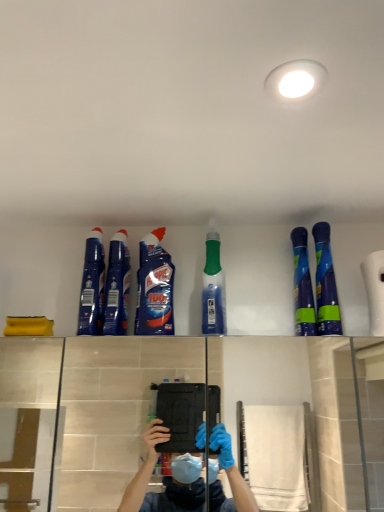
Question: Does blue glossy cleaner at upper left, the 6th cleaning product when ordered from right to left, come behind green translucent bottle at center, which is counted as the third cleaning product, starting from the right?

Choices:
 (A) no
 (B) yes

Answer: (B)

Question: From the image's perspective, is blue glossy cleaner at upper left, placed as the 1th cleaning product when sorted from left to right, under green translucent bottle at center, marked as the fourth cleaning product in a left-to-right arrangement?

Choices:
 (A) no
 (B) yes

Answer: (B)

Question: Is blue glossy cleaner at upper left, the 6th cleaning product when ordered from right to left, taller than green translucent bottle at center, marked as the fourth cleaning product in a left-to-right arrangement?

Choices:
 (A) yes
 (B) no

Answer: (B)

Question: Does blue glossy cleaner at upper left, the 6th cleaning product when ordered from right to left, lie in front of green translucent bottle at center, marked as the fourth cleaning product in a left-to-right arrangement?

Choices:
 (A) no
 (B) yes

Answer: (A)

Question: Considering the relative sizes of blue glossy cleaner at upper left, placed as the 1th cleaning product when sorted from left to right, and green translucent bottle at center, marked as the fourth cleaning product in a left-to-right arrangement, in the image provided, is blue glossy cleaner at upper left, placed as the 1th cleaning product when sorted from left to right, thinner than green translucent bottle at center, marked as the fourth cleaning product in a left-to-right arrangement,?

Choices:
 (A) no
 (B) yes

Answer: (A)

Question: In terms of height, does blue glossy spray bottles at upper right, the fifth cleaning product from the left, look taller or shorter compared to blue glossy cleaner at upper left, placed as the 1th cleaning product when sorted from left to right?

Choices:
 (A) short
 (B) tall

Answer: (B)

Question: Considering the relative positions of blue glossy spray bottles at upper right, marked as the second cleaning product in a right-to-left arrangement, and blue glossy cleaner at upper left, placed as the 1th cleaning product when sorted from left to right, in the image provided, is blue glossy spray bottles at upper right, marked as the second cleaning product in a right-to-left arrangement, to the left or to the right of blue glossy cleaner at upper left, placed as the 1th cleaning product when sorted from left to right,?

Choices:
 (A) left
 (B) right

Answer: (B)

Question: From the image's perspective, is blue glossy spray bottles at upper right, the fifth cleaning product from the left, located above or below blue glossy cleaner at upper left, the 6th cleaning product when ordered from right to left?

Choices:
 (A) below
 (B) above

Answer: (A)

Question: Based on their sizes in the image, would you say blue glossy spray bottles at upper right, marked as the second cleaning product in a right-to-left arrangement, is bigger or smaller than blue glossy cleaner at upper left, placed as the 1th cleaning product when sorted from left to right?

Choices:
 (A) small
 (B) big

Answer: (A)

Question: From a real-world perspective, is green translucent bottle at center, marked as the fourth cleaning product in a left-to-right arrangement, physically located above or below blue glossy cleaner at center, which appears as the fifth cleaning product when viewed from the right?

Choices:
 (A) below
 (B) above

Answer: (A)

Question: Considering the positions of green translucent bottle at center, which is counted as the third cleaning product, starting from the right, and blue glossy cleaner at center, acting as the second cleaning product starting from the left, in the image, is green translucent bottle at center, which is counted as the third cleaning product, starting from the right, taller or shorter than blue glossy cleaner at center, acting as the second cleaning product starting from the left,?

Choices:
 (A) tall
 (B) short

Answer: (A)

Question: From the image's perspective, is green translucent bottle at center, marked as the fourth cleaning product in a left-to-right arrangement, located above or below blue glossy cleaner at center, which appears as the fifth cleaning product when viewed from the right?

Choices:
 (A) above
 (B) below

Answer: (A)

Question: Is green translucent bottle at center, which is counted as the third cleaning product, starting from the right, wider or thinner than blue glossy cleaner at center, acting as the second cleaning product starting from the left?

Choices:
 (A) wide
 (B) thin

Answer: (B)

Question: Is blue glossy spray bottle at upper right, positioned as the first cleaning product in right-to-left order, wider or thinner than blue glossy cleaner at center, acting as the second cleaning product starting from the left?

Choices:
 (A) thin
 (B) wide

Answer: (A)

Question: From a real-world perspective, relative to blue glossy cleaner at center, which appears as the fifth cleaning product when viewed from the right, is blue glossy spray bottle at upper right, positioned as the first cleaning product in right-to-left order, vertically above or below?

Choices:
 (A) below
 (B) above

Answer: (A)